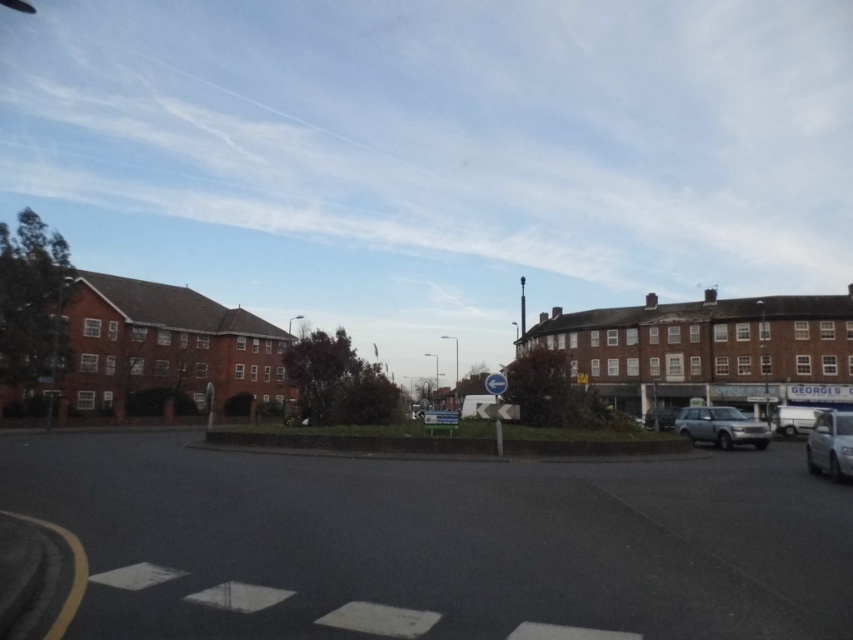
From the picture: Between dark asphalt road at center and silver metallic suv at center-right, which one has more height?

silver metallic suv at center-right

Is the position of dark asphalt road at center more distant than that of silver metallic suv at center-right?

No.

What do you see at coordinates (440, 540) in the screenshot? The width and height of the screenshot is (853, 640). I see `dark asphalt road at center` at bounding box center [440, 540].

The height and width of the screenshot is (640, 853). Find the location of `dark asphalt road at center`. dark asphalt road at center is located at coordinates (440, 540).

Is dark asphalt road at center closer to the viewer compared to silver metallic car at right?

Yes, dark asphalt road at center is in front of silver metallic car at right.

Describe the element at coordinates (440, 540) in the screenshot. This screenshot has width=853, height=640. I see `dark asphalt road at center` at that location.

Which is in front, point (526, 476) or point (848, 448)?

Positioned in front is point (848, 448).

This screenshot has height=640, width=853. I want to click on dark asphalt road at center, so click(440, 540).

At what (x,y) coordinates should I click in order to perform the action: click on silver metallic suv at center-right. Please return your answer as a coordinate pair (x, y). Looking at the image, I should click on (721, 426).

Who is higher up, silver metallic suv at center-right or silver metallic car at right?

silver metallic car at right is higher up.

Where is `silver metallic suv at center-right`? This screenshot has width=853, height=640. silver metallic suv at center-right is located at coordinates (721, 426).

You are a GUI agent. You are given a task and a screenshot of the screen. Output one action in this format:
    pyautogui.click(x=<x>, y=<y>)
    Task: Click on the silver metallic suv at center-right
    This screenshot has width=853, height=640.
    Given the screenshot: What is the action you would take?
    pyautogui.click(x=721, y=426)